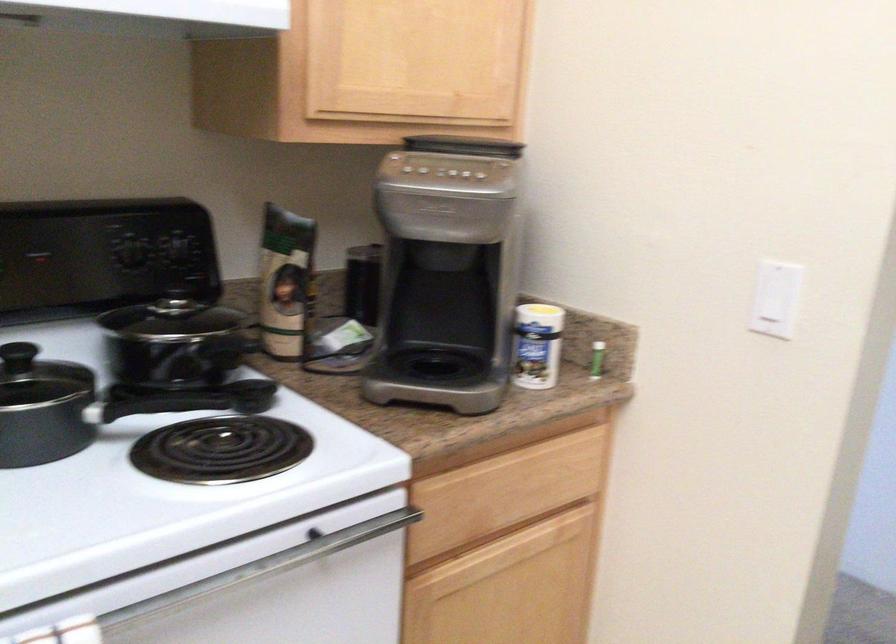
This screenshot has height=644, width=896. Describe the element at coordinates (247, 574) in the screenshot. I see `the metal oven handle` at that location.